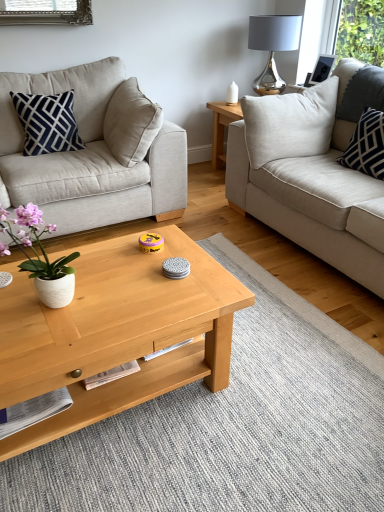
Where is `free location in front of white ceramic pot at left`? This screenshot has height=512, width=384. free location in front of white ceramic pot at left is located at coordinates (40, 344).